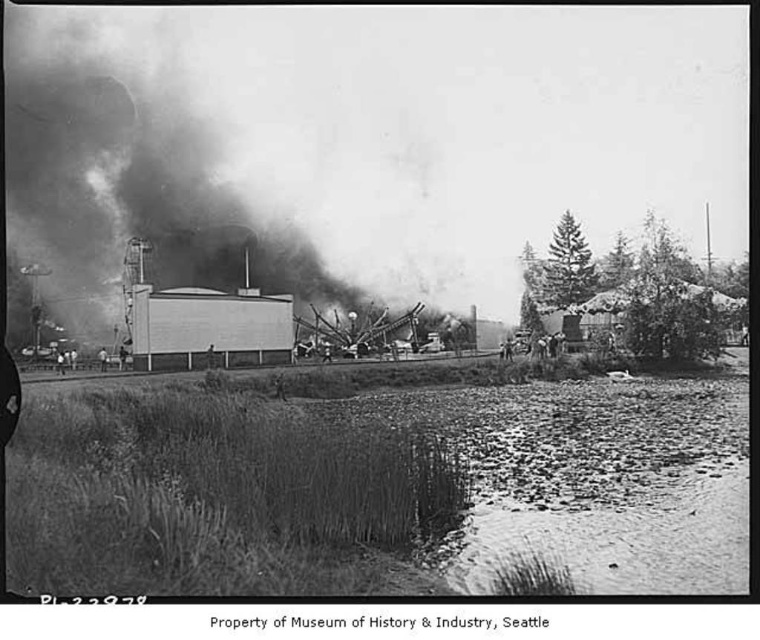
In the scene shown: You are standing at the point with coordinates point (95, 109) and want to reach the safety zone located 500 feet away from the explosion site. Are you currently within the safe distance?

The point (95, 109) and viewer are 499.08 feet apart from each other, so you are within the safe distance of 500 feet and can proceed to the safety zone.

In the historical industrial scene, there is black smoke at upper left and a smooth skin man at center. Based on their positions, which object is located to the left of the other?

The black smoke at upper left is located to the left of the smooth skin man at center.